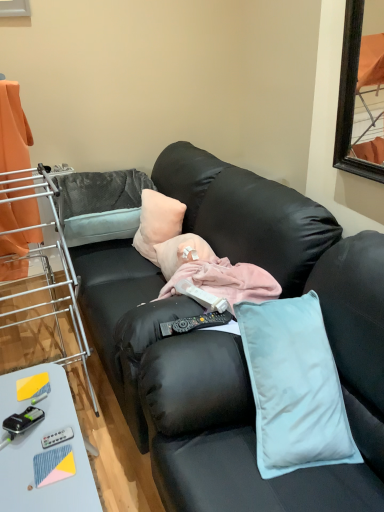
Locate an element on the screen. This screenshot has height=512, width=384. free point behind metallic silver remote control at lower left, the second equipment when ordered from left to right is located at coordinates (47, 407).